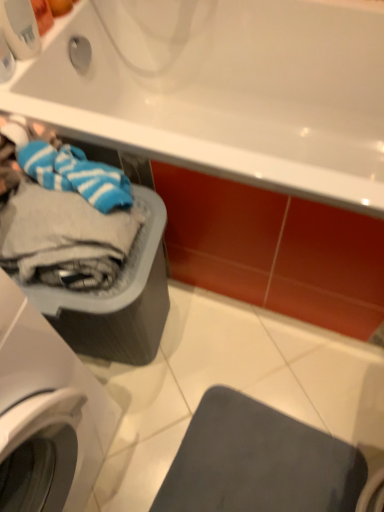
In order to click on free space underneath matte gray mat at lower right (from a real-world perspective) in this screenshot , I will do `click(262, 462)`.